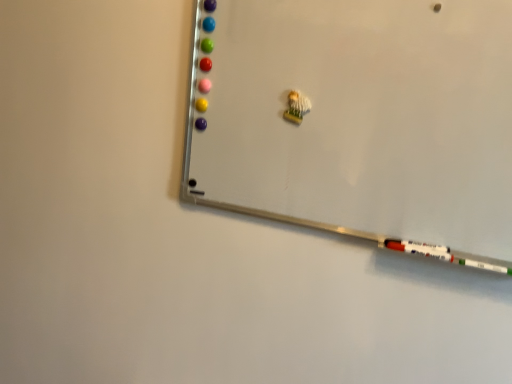
Where is `white matte eraser at center`? white matte eraser at center is located at coordinates (358, 120).

This screenshot has height=384, width=512. Describe the element at coordinates (358, 120) in the screenshot. I see `white matte eraser at center` at that location.

Where is `white matte eraser at center`? Image resolution: width=512 pixels, height=384 pixels. white matte eraser at center is located at coordinates point(358,120).